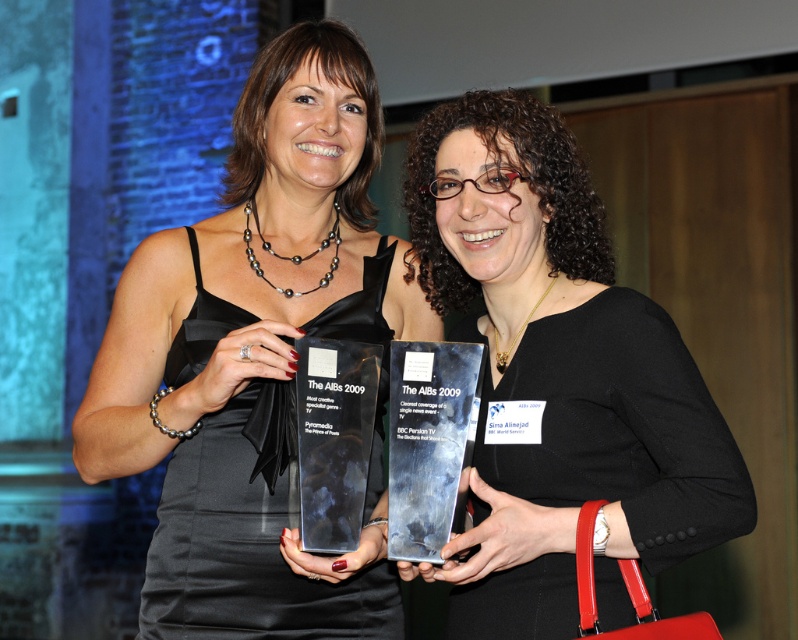
Is satin black dress at center below matte black award at center?

No.

Who is more forward, (299, 38) or (656, 547)?

Positioned in front is point (656, 547).

Does point (283, 465) lie in front of point (642, 307)?

That is False.

The height and width of the screenshot is (640, 798). Identify the location of satin black dress at center. (255, 356).